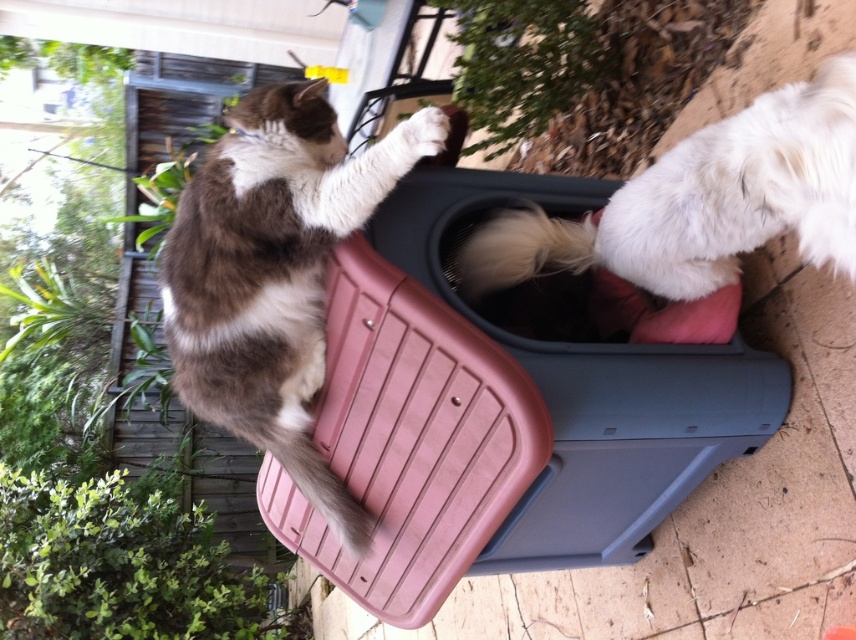
Which is in front, point (310, 129) or point (569, 264)?

Point (310, 129) is more forward.

Is brown and white fur cat at upper left taller than blonde fur tail at center?

Indeed, brown and white fur cat at upper left has a greater height compared to blonde fur tail at center.

At what (x,y) coordinates should I click in order to perform the action: click on brown and white fur cat at upper left. Please return your answer as a coordinate pair (x, y). The height and width of the screenshot is (640, 856). Looking at the image, I should click on (274, 273).

Can you confirm if white fluffy dog at upper right is smaller than blonde fur tail at center?

Actually, white fluffy dog at upper right might be larger than blonde fur tail at center.

Which is behind, point (742, 243) or point (501, 212)?

Positioned behind is point (501, 212).

Where is `white fluffy dog at upper right`? white fluffy dog at upper right is located at coordinates (704, 202).

Does brown and white fur cat at upper left have a greater width compared to white fluffy dog at upper right?

No.

Where is `brown and white fur cat at upper left`? brown and white fur cat at upper left is located at coordinates (274, 273).